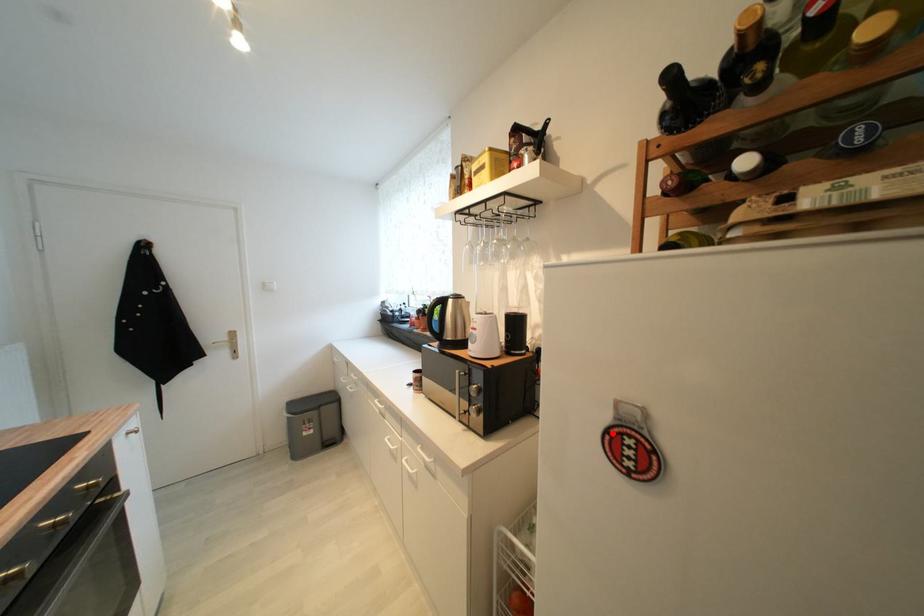
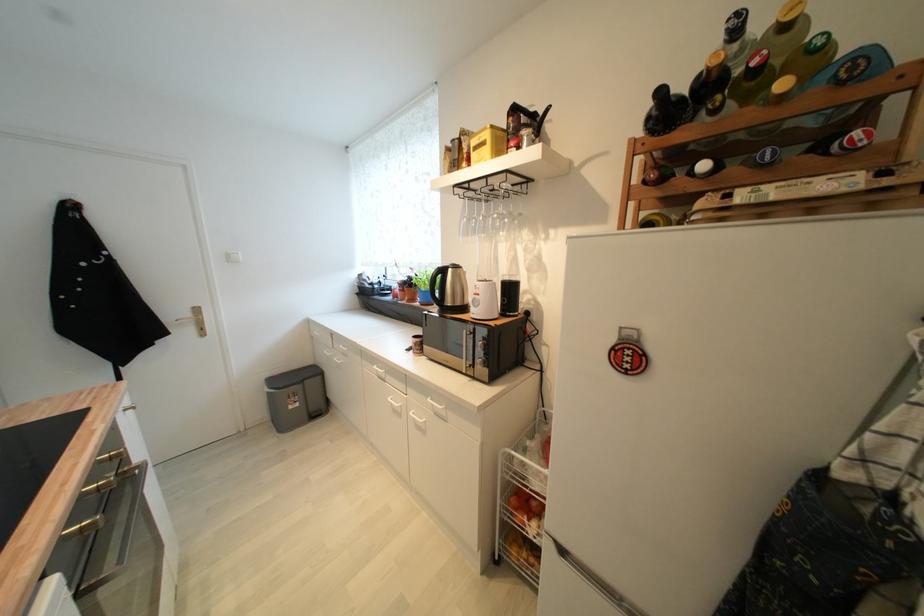
Find the pixel in the second image that matches the highlighted location in the first image.

(618, 351)